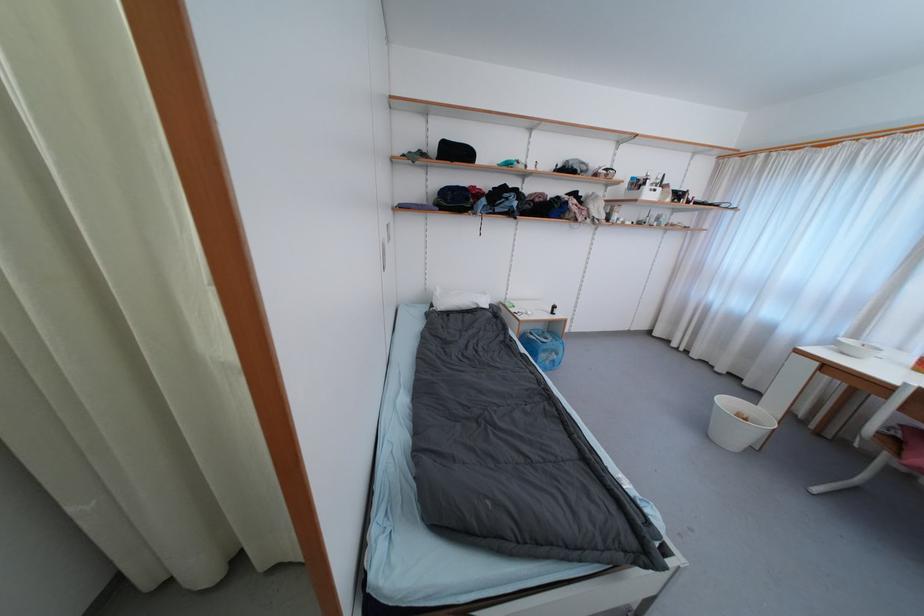
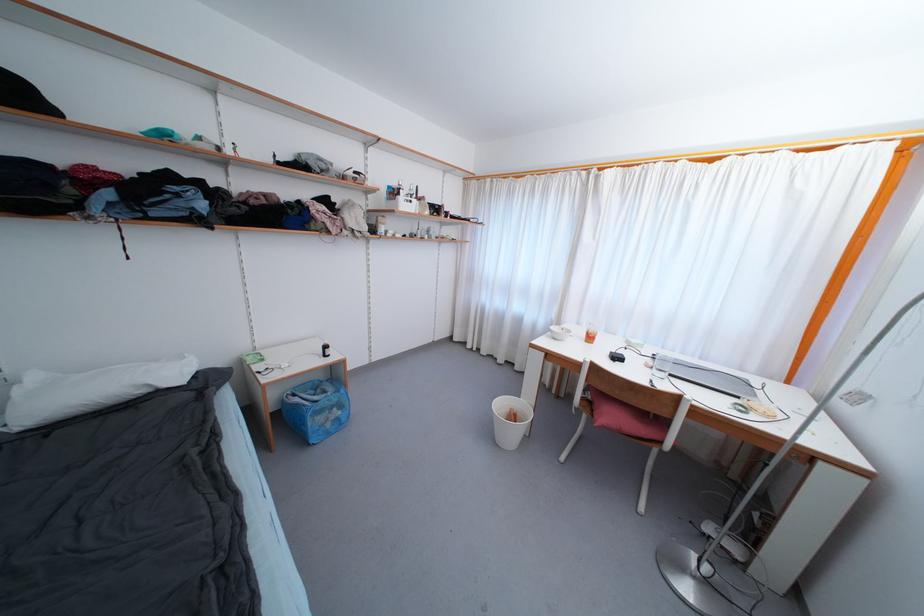
The point at (x=558, y=310) is marked in the first image. Where is the corresponding point in the second image?

(330, 350)